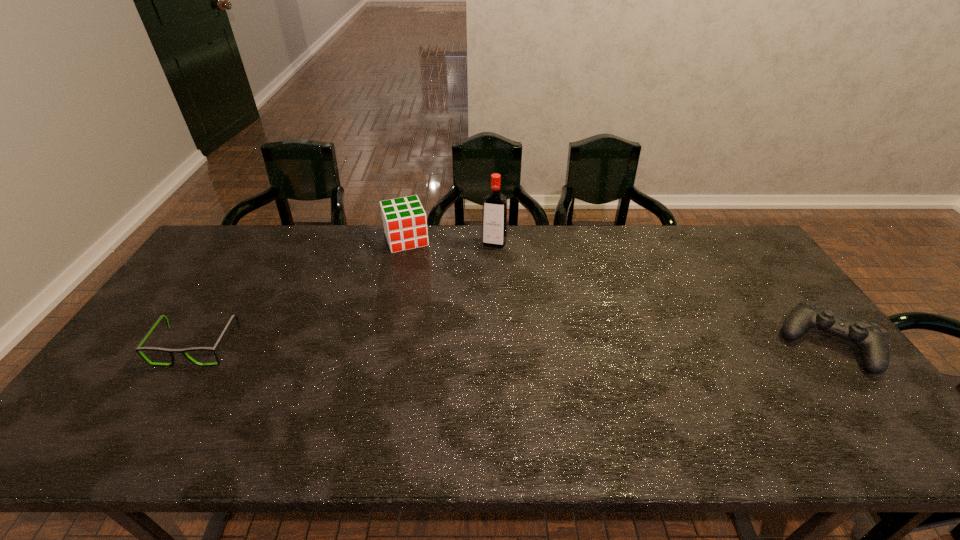
The image size is (960, 540). Identify the location of vacant space on the desktop that is between the shortest object and the rightmost object and is positioned on the front and back of the vodka. (463, 346).

Locate an element on the screen. Image resolution: width=960 pixels, height=540 pixels. vacant space on the desktop that is between the shortest object and the rightmost object and is positioned on the red face of the second object from left to right is located at coordinates (447, 346).